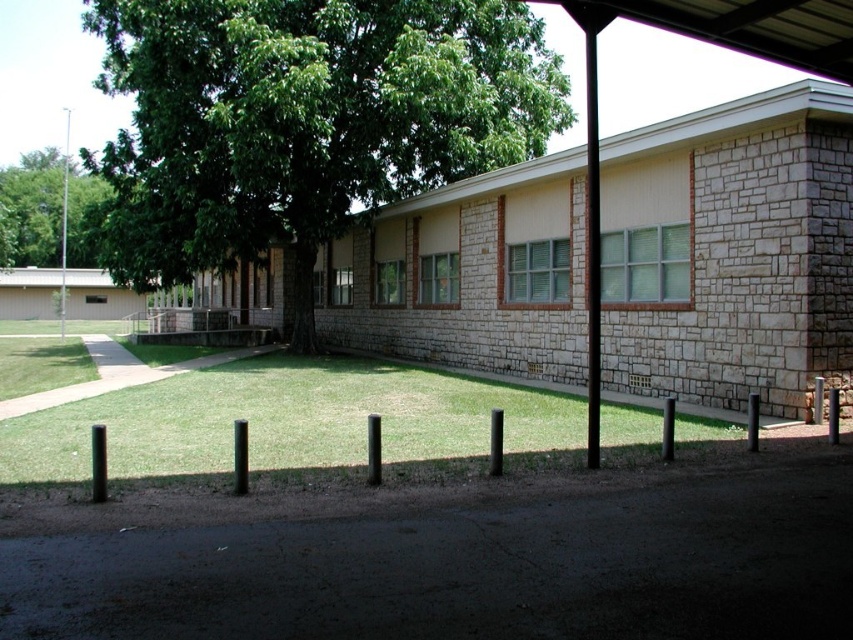
Question: Is green grass at center thinner than black metal awning at upper center?

Choices:
 (A) no
 (B) yes

Answer: (B)

Question: Based on their relative distances, which object is farther from the green leafy tree at upper left?

Choices:
 (A) green leafy tree at center
 (B) green grass at center

Answer: (B)

Question: Which object is the closest to the green leafy tree at center?

Choices:
 (A) green leafy tree at upper left
 (B) green grass at center
 (C) black metal awning at upper center

Answer: (B)

Question: Does green grass at center appear over black metal awning at upper center?

Choices:
 (A) yes
 (B) no

Answer: (B)

Question: Is green leafy tree at center wider than green grass at center?

Choices:
 (A) no
 (B) yes

Answer: (B)

Question: Which of the following is the farthest from the observer?

Choices:
 (A) (782, 36)
 (B) (553, 396)
 (C) (247, 67)
 (D) (51, 256)

Answer: (D)